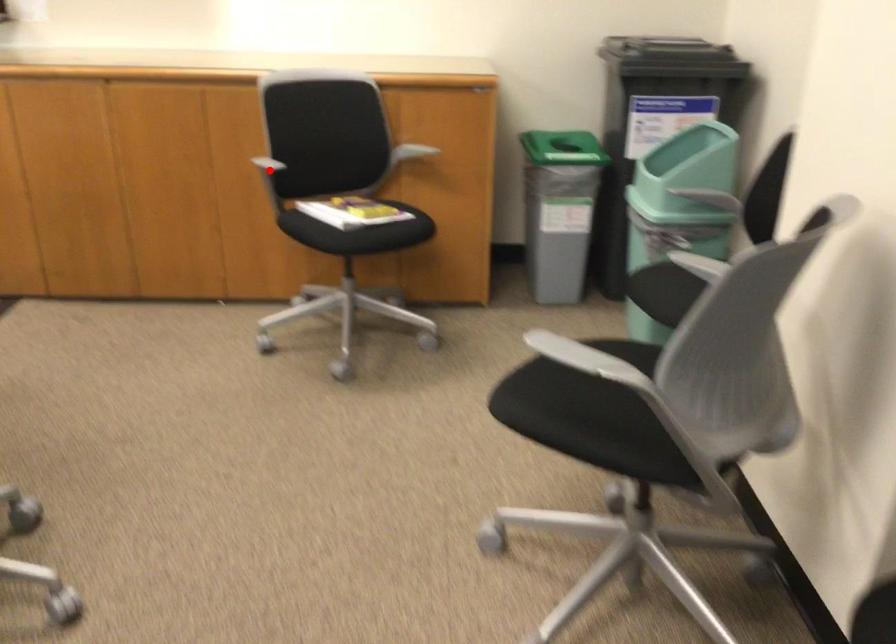
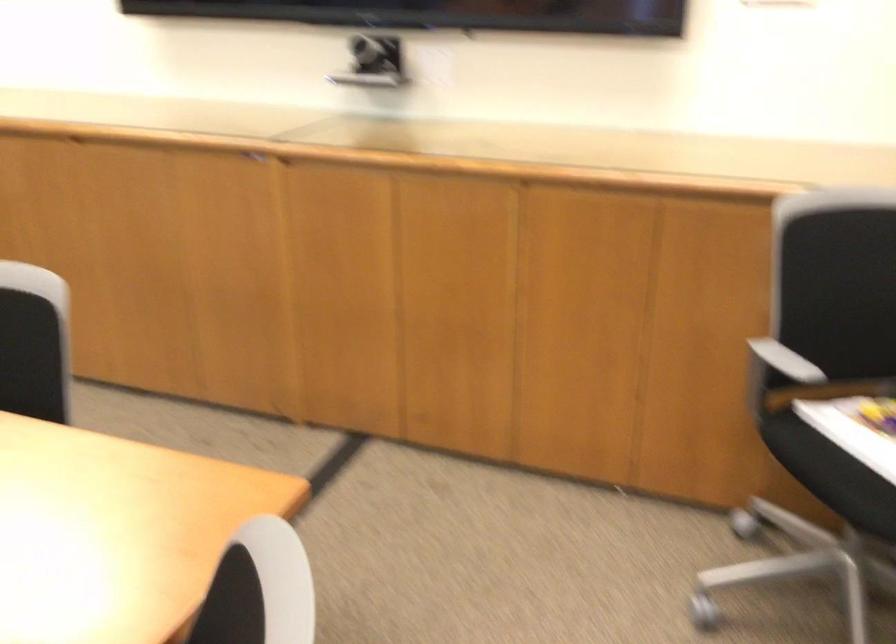
Question: A red point is marked in image1. In image2, is the corresponding 3D point closer to the camera or farther? Reply with the corresponding letter.

Choices:
 (A) The corresponding 3D point is closer.
 (B) The corresponding 3D point is farther.

Answer: (A)